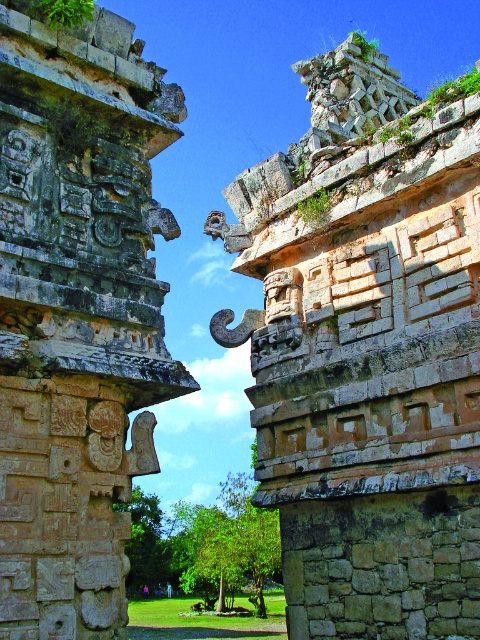
You are an archaeologist examining the ancient Mayan site. You notice two features in the scene. One is the weathered stone ruins at upper right and the other is the gray stone carvings at left. Which of these two features is taller?

The weathered stone ruins at upper right is much taller than the gray stone carvings at left.

You are an archaeologist standing at the base of the ancient Mayan site. You notice the weathered stone ruins at upper right in the distance. If your laser rangefinder indicates a distance of 40 meters to the ruins, would you need to adjust your equipment or suspect an error?

The weathered stone ruins at upper right is 41.24 meters away from viewer. Since the measured distance is 40 meters, there is a discrepancy of 1.24 meters. This could indicate a need to calibrate the equipment or consider possible measurement error.

You are an archaeologist examining the ancient Mayan site. You notice two key features in the scene. The weathered stone ruins at upper right and the gray stone carvings at left. Which of these two features is positioned to the right of the other?

The weathered stone ruins at upper right are positioned to the right of the gray stone carvings at left.